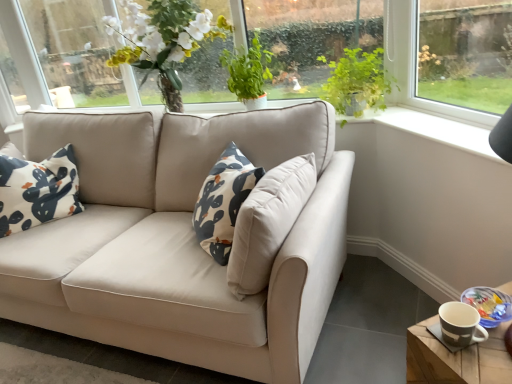
Question: From a real-world perspective, is wooden coaster at lower right below matte brown mug at lower right?

Choices:
 (A) no
 (B) yes

Answer: (B)

Question: Does wooden coaster at lower right appear on the left side of matte brown mug at lower right?

Choices:
 (A) no
 (B) yes

Answer: (A)

Question: Can you confirm if wooden coaster at lower right is smaller than matte brown mug at lower right?

Choices:
 (A) no
 (B) yes

Answer: (A)

Question: Is wooden coaster at lower right looking in the opposite direction of matte brown mug at lower right?

Choices:
 (A) no
 (B) yes

Answer: (A)

Question: Considering the relative positions of wooden coaster at lower right and matte brown mug at lower right in the image provided, is wooden coaster at lower right behind matte brown mug at lower right?

Choices:
 (A) yes
 (B) no

Answer: (B)

Question: In terms of size, does wooden coaster at lower right appear bigger or smaller than green leafy plant at upper right, which appears as the 2th plant when viewed from the left?

Choices:
 (A) small
 (B) big

Answer: (B)

Question: From their relative heights in the image, would you say wooden coaster at lower right is taller or shorter than green leafy plant at upper right, the 1th plant in the right-to-left sequence?

Choices:
 (A) tall
 (B) short

Answer: (A)

Question: Would you say wooden coaster at lower right is to the left or to the right of green leafy plant at upper right, which appears as the 2th plant when viewed from the left, in the picture?

Choices:
 (A) right
 (B) left

Answer: (A)

Question: From the image's perspective, is wooden coaster at lower right located above or below green leafy plant at upper right, which appears as the 2th plant when viewed from the left?

Choices:
 (A) below
 (B) above

Answer: (A)

Question: Would you say green leafy plant at upper center, marked as the first plant in a left-to-right arrangement, is to the left or to the right of wooden coaster at lower right in the picture?

Choices:
 (A) right
 (B) left

Answer: (B)

Question: Is green leafy plant at upper center, positioned as the second plant in right-to-left order, bigger or smaller than wooden coaster at lower right?

Choices:
 (A) small
 (B) big

Answer: (A)

Question: Considering the positions of green leafy plant at upper center, positioned as the second plant in right-to-left order, and wooden coaster at lower right in the image, is green leafy plant at upper center, positioned as the second plant in right-to-left order, wider or thinner than wooden coaster at lower right?

Choices:
 (A) thin
 (B) wide

Answer: (A)

Question: Relative to wooden coaster at lower right, is green leafy plant at upper center, positioned as the second plant in right-to-left order, in front or behind?

Choices:
 (A) behind
 (B) front

Answer: (A)

Question: From a real-world perspective, is green leafy plant at upper right, which appears as the 2th plant when viewed from the left, positioned above or below green leafy plant at upper center, marked as the first plant in a left-to-right arrangement?

Choices:
 (A) below
 (B) above

Answer: (A)

Question: Is green leafy plant at upper right, which appears as the 2th plant when viewed from the left, in front of or behind green leafy plant at upper center, positioned as the second plant in right-to-left order, in the image?

Choices:
 (A) behind
 (B) front

Answer: (B)